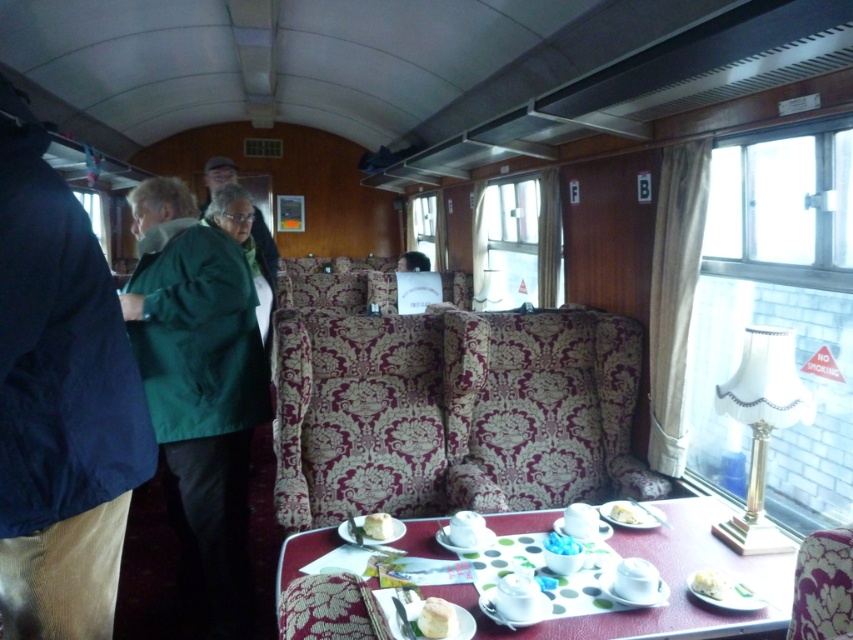
Which is in front, point (7, 99) or point (250, 413)?

Point (7, 99) is more forward.

Can you confirm if dark blue fabric coat at left is smaller than green fabric jacket at left?

Correct, dark blue fabric coat at left occupies less space than green fabric jacket at left.

Identify the location of dark blue fabric coat at left. (59, 401).

Which of these two, dark blue fabric coat at left or white fluffy bread at table center, stands taller?

dark blue fabric coat at left is taller.

Does dark blue fabric coat at left have a lesser width compared to white fluffy bread at table center?

No.

What do you see at coordinates (59, 401) in the screenshot? This screenshot has height=640, width=853. I see `dark blue fabric coat at left` at bounding box center [59, 401].

Locate an element on the screen. The width and height of the screenshot is (853, 640). dark blue fabric coat at left is located at coordinates (59, 401).

Measure the distance between point [138,259] and camera.

A distance of 2.32 meters exists between point [138,259] and camera.

Measure the distance between green fabric jacket at left and camera.

They are 6.59 feet apart.

Who is more forward, [165,349] or [787,616]?

Point [787,616] is more forward.

Identify the location of green fabric jacket at left. The width and height of the screenshot is (853, 640). (201, 380).